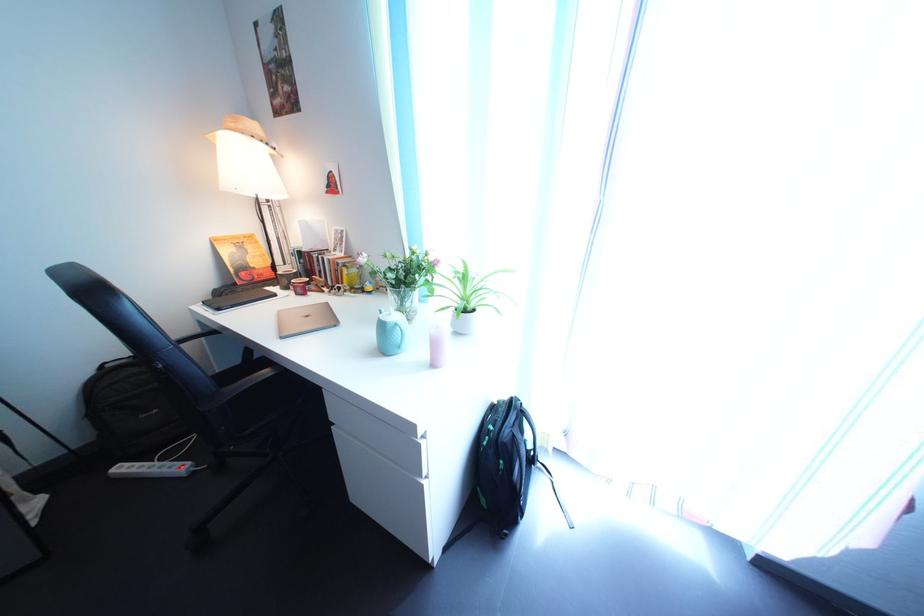
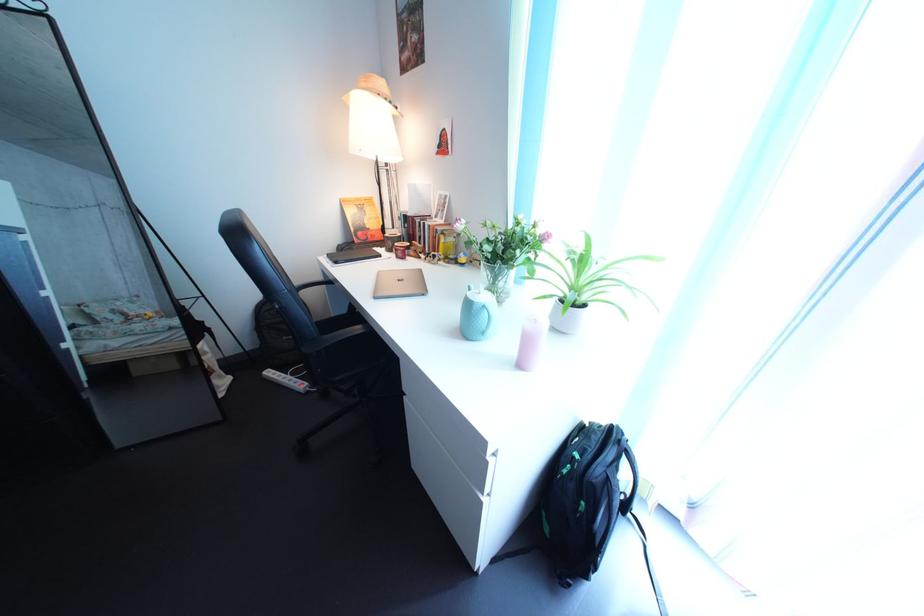
The point at (x=511, y=429) is marked in the first image. Where is the corresponding point in the second image?

(600, 458)